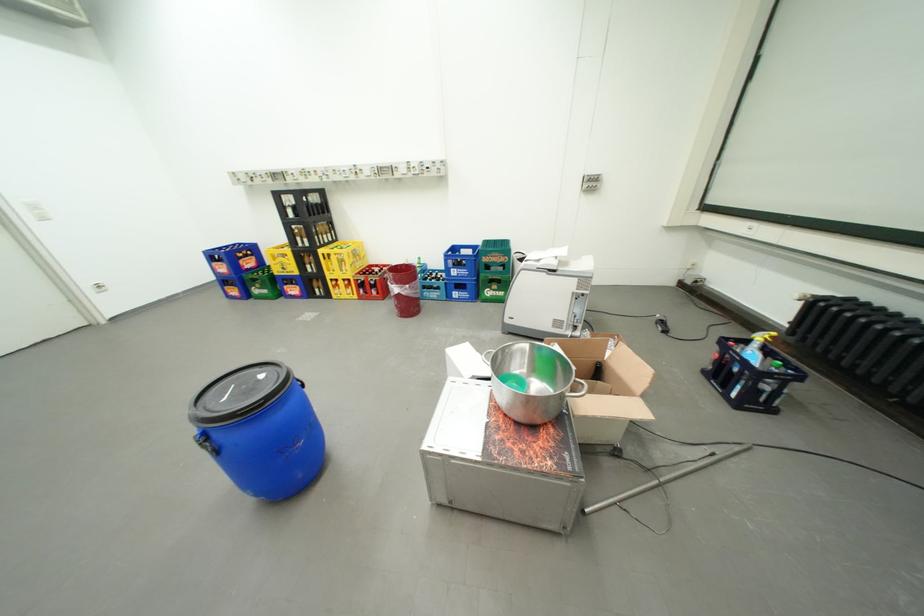
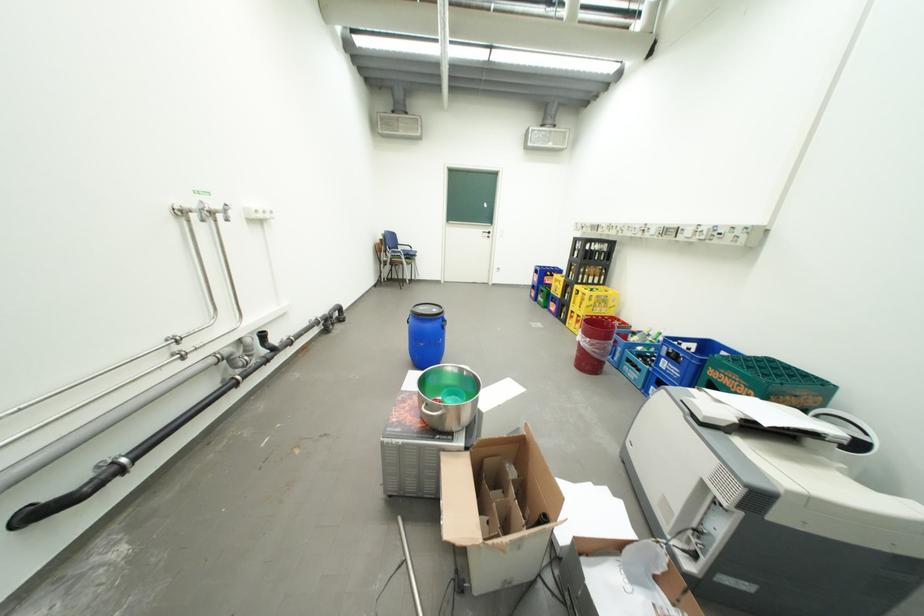
The point at (513, 257) is marked in the first image. Where is the corresponding point in the second image?

(756, 387)